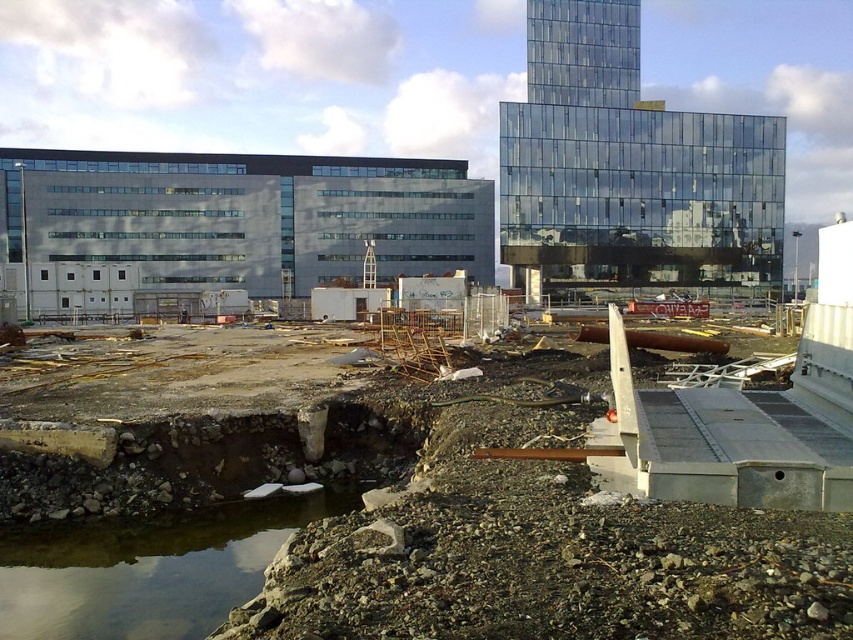
The height and width of the screenshot is (640, 853). I want to click on rustic concrete foundation at center, so click(573, 522).

Can you confirm if rustic concrete foundation at center is wider than gray concrete building at left?

In fact, rustic concrete foundation at center might be narrower than gray concrete building at left.

The image size is (853, 640). Identify the location of rustic concrete foundation at center. (573, 522).

You are a GUI agent. You are given a task and a screenshot of the screen. Output one action in this format:
    pyautogui.click(x=<x>, y=<y>)
    Task: Click on the rustic concrete foundation at center
    This screenshot has width=853, height=640.
    Given the screenshot: What is the action you would take?
    pyautogui.click(x=573, y=522)

Who is more forward, (747, 449) or (688, 216)?

Point (747, 449)

Which of these two, rustic concrete foundation at center or transparent glass building at upper center, stands shorter?

With less height is rustic concrete foundation at center.

The image size is (853, 640). In order to click on rustic concrete foundation at center in this screenshot , I will do click(x=573, y=522).

This screenshot has width=853, height=640. Describe the element at coordinates (228, 225) in the screenshot. I see `gray concrete building at left` at that location.

The width and height of the screenshot is (853, 640). What do you see at coordinates (228, 225) in the screenshot?
I see `gray concrete building at left` at bounding box center [228, 225].

Where is `gray concrete building at left`? gray concrete building at left is located at coordinates (228, 225).